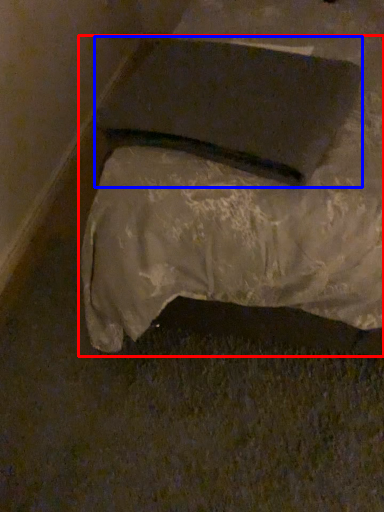
Question: Which object is closer to the camera taking this photo, furniture (highlighted by a red box) or pad (highlighted by a blue box)?

Choices:
 (A) furniture
 (B) pad

Answer: (A)